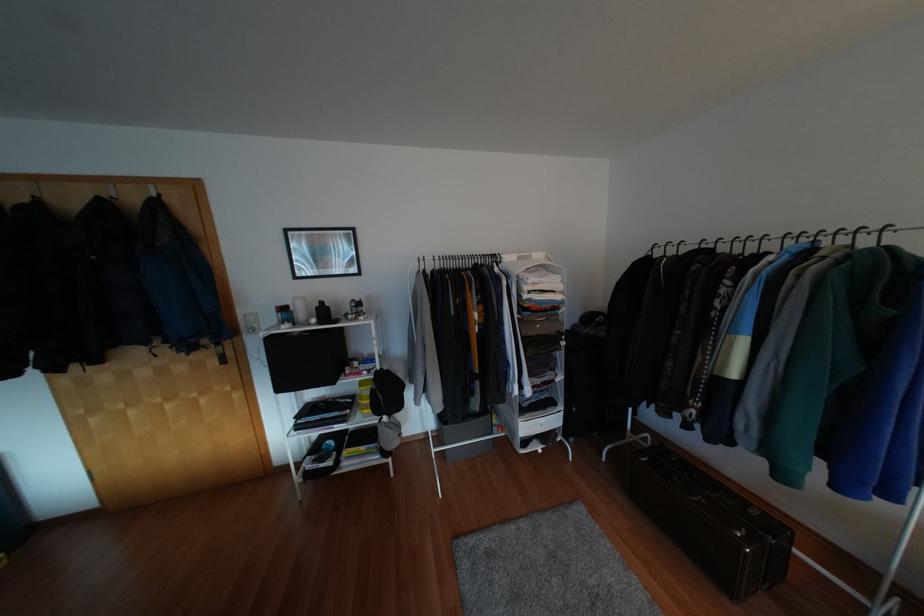
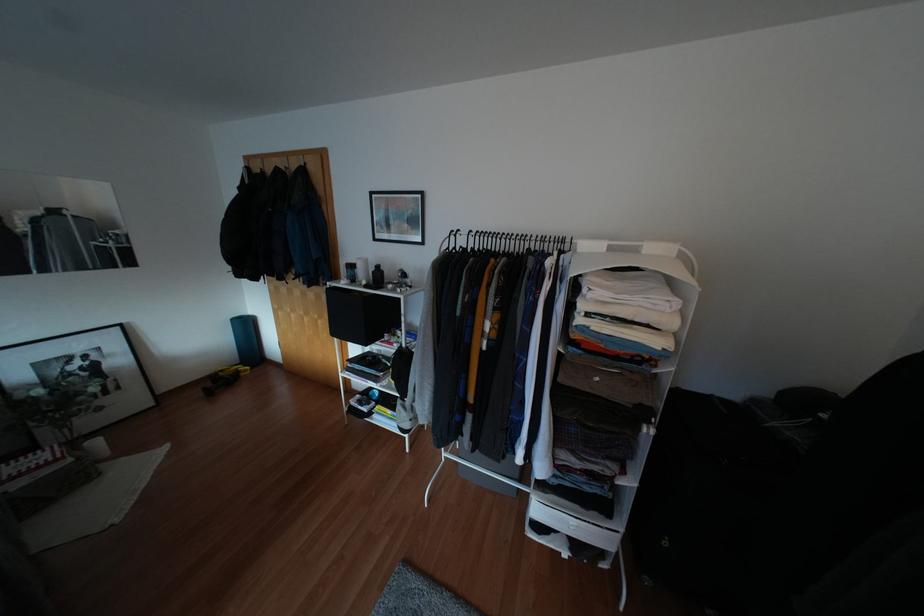
In the second image, find the point that corresponds to point (312, 320) in the first image.

(362, 282)